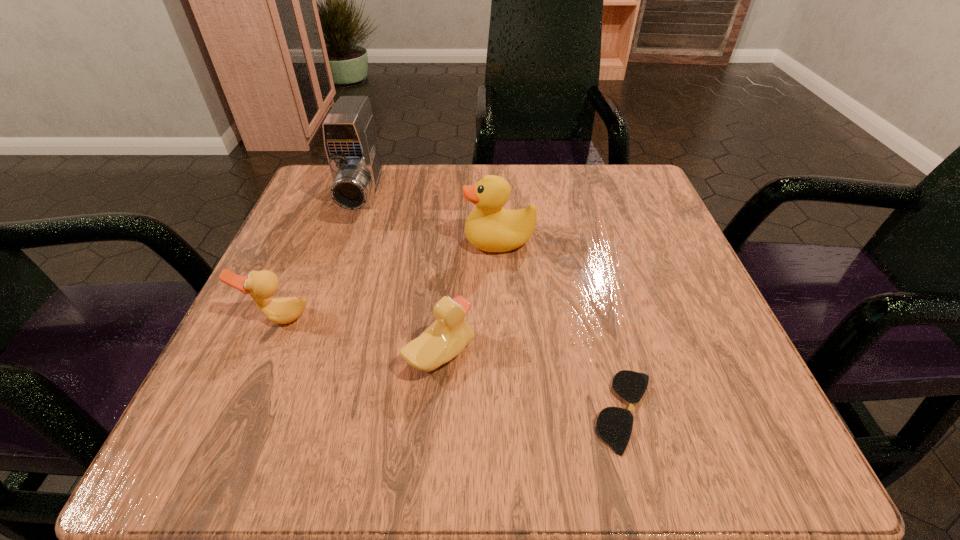
The image size is (960, 540). Identify the location of vacant space at the far edge. (567, 198).

The image size is (960, 540). I want to click on free space at the near edge of the desktop, so click(x=324, y=463).

In the image, there is a desktop. Identify the location of vacant area at the left edge. The width and height of the screenshot is (960, 540). (371, 233).

In the image, there is a desktop. Where is `vacant area at the right edge`? This screenshot has width=960, height=540. vacant area at the right edge is located at coordinates (617, 232).

The height and width of the screenshot is (540, 960). I want to click on blank space at the far left corner, so click(x=324, y=205).

I want to click on vacant space at the far right corner of the desktop, so click(x=636, y=202).

This screenshot has width=960, height=540. I want to click on empty space that is in between the farthest duck and the leftmost duck, so click(x=389, y=279).

I want to click on free space between the tallest duck and the camcorder, so click(431, 219).

The height and width of the screenshot is (540, 960). Identify the location of empty space that is in between the tallest duck and the shortest object. (563, 326).

Find the location of `vacant space that is in between the spectacles and the leftmost duck`. vacant space that is in between the spectacles and the leftmost duck is located at coordinates (452, 364).